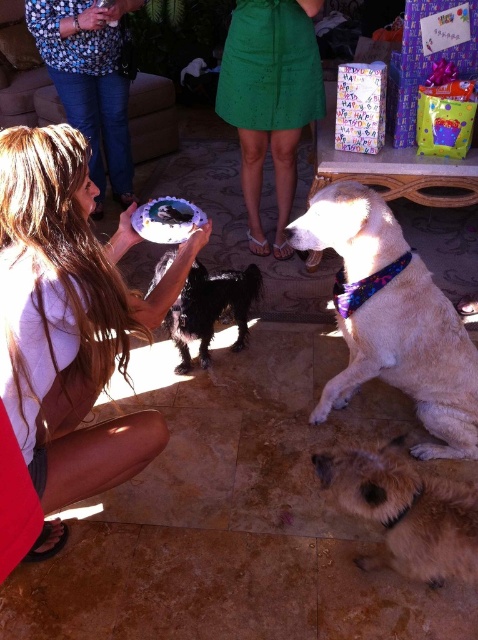
You are a photographer standing in the living room and want to take a photo of the light brown fur at lower right and the blue printed shirt at upper left. Which one is shorter in height?

The light brown fur at lower right is shorter than the blue printed shirt at upper left.